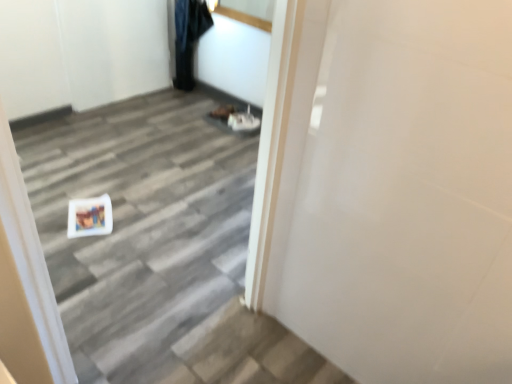
At what (x,y) coordinates should I click in order to perform the action: click on free space behind white glossy door at center. Please return your answer as a coordinate pair (x, y). Looking at the image, I should click on (175, 289).